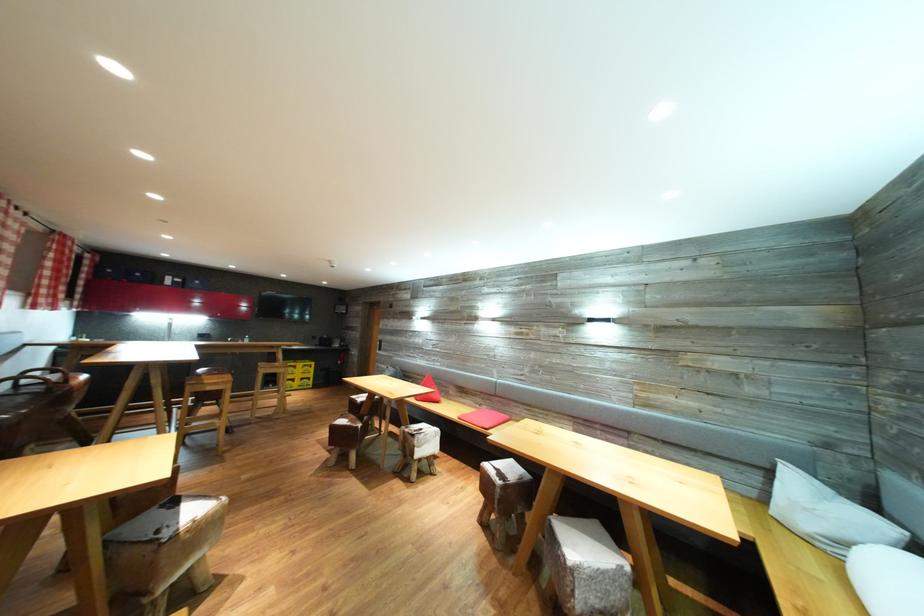
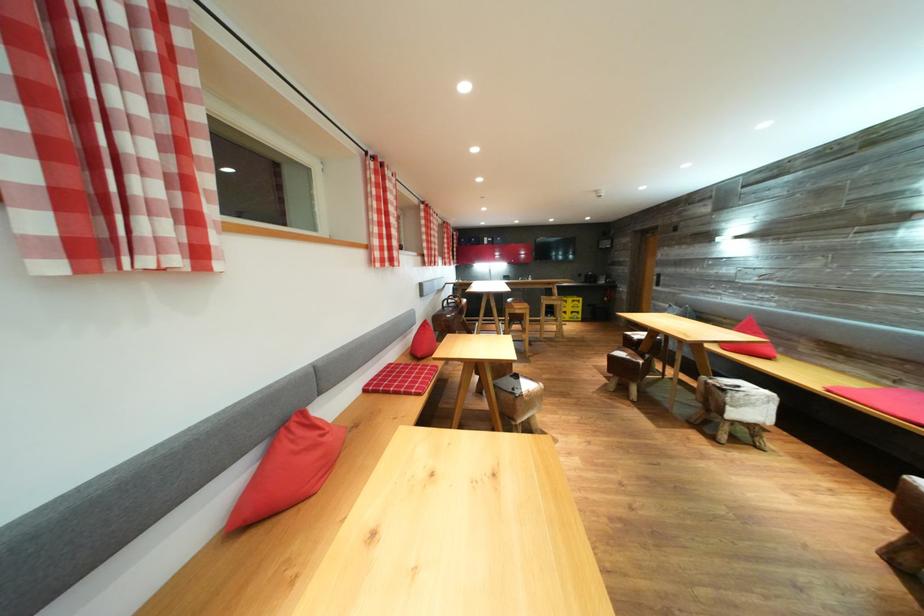
The point at [367,431] is marked in the first image. Where is the corresponding point in the second image?

(648, 367)